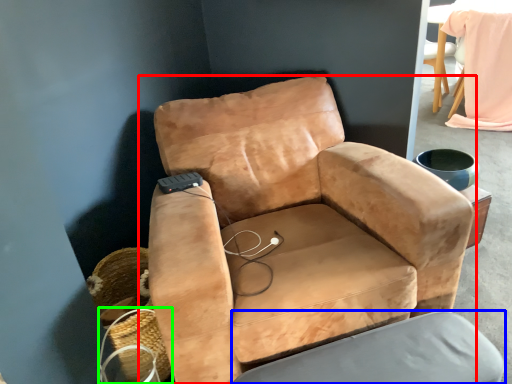
Question: Which object is positioned closest to chair (highlighted by a red box)? Select from swivel chair (highlighted by a blue box) and basket (highlighted by a green box).

Choices:
 (A) swivel chair
 (B) basket

Answer: (A)